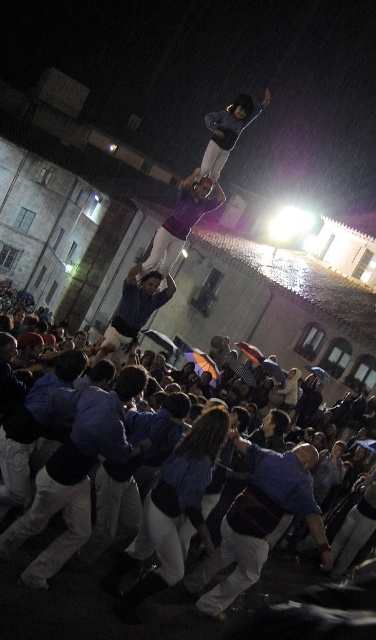
You are standing at the camera position and want to know how far the point at coordinates (221,561) is from you. Can you determine the distance?

The point at coordinates (221,561) is 28.49 meters away from the camera position.

In the nighttime scene of the human tower construction, there are two points marked as point 1 at coordinates point (71, 490) and point 2 at coordinates point (121, 307). From the perspective of someone standing at the base of the tower, which point is closer to them?

Point (71, 490) is in front of point (121, 307), so from the perspective of someone at the base of the tower, point (71, 490) is closer to them.

You are a photographer at the event and want to capture a photo of the blue fabric shirt at center and the matte black skateboard at upper center. From the photographer perspective, which object is positioned to the left?

The blue fabric shirt at center is positioned to the left of the matte black skateboard at upper center.